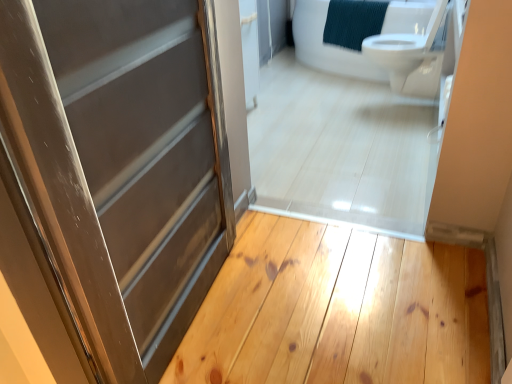
What is the approximate width of matte gray door at center?

The width of matte gray door at center is 3.76 inches.

Find the location of a particular element. The height and width of the screenshot is (384, 512). white glossy toilet at upper right is located at coordinates (412, 55).

Where is `light brown wood plank at center`? light brown wood plank at center is located at coordinates (338, 310).

Is matte gray door at center directly adjacent to light brown wood plank at center?

They are not placed beside each other.

Which object is closer to the camera, matte gray door at center or light brown wood plank at center?

matte gray door at center is closer to the camera.

Which of these two, matte gray door at center or light brown wood plank at center, is smaller?

With smaller size is light brown wood plank at center.

Considering the positions of objects matte gray door at center and light brown wood plank at center in the image provided, who is more to the left, matte gray door at center or light brown wood plank at center?

Positioned to the left is matte gray door at center.

Which of these two, matte gray door at center or white glossy toilet at upper right, is bigger?

With larger size is white glossy toilet at upper right.

Is matte gray door at center to the left of white glossy toilet at upper right from the viewer's perspective?

Correct, you'll find matte gray door at center to the left of white glossy toilet at upper right.

Is matte gray door at center wider than white glossy toilet at upper right?

No, matte gray door at center is not wider than white glossy toilet at upper right.

Considering the points (130, 52) and (421, 74), which point is in front, point (130, 52) or point (421, 74)?

Positioned in front is point (130, 52).

From the image's perspective, would you say white glossy toilet at upper right is positioned over matte gray door at center?

Correct, white glossy toilet at upper right appears higher than matte gray door at center in the image.

Considering the positions of objects white glossy toilet at upper right and matte gray door at center in the image provided, who is more to the right, white glossy toilet at upper right or matte gray door at center?

white glossy toilet at upper right is more to the right.

From a real-world perspective, is white glossy toilet at upper right above or below matte gray door at center?

white glossy toilet at upper right is below matte gray door at center.

Is white glossy toilet at upper right looking in the opposite direction of matte gray door at center?

white glossy toilet at upper right does not have its back to matte gray door at center.

Looking at this image, is light brown wood plank at center spatially inside matte gray door at center, or outside of it?

light brown wood plank at center cannot be found inside matte gray door at center.

Considering the relative sizes of light brown wood plank at center and matte gray door at center in the image provided, is light brown wood plank at center wider than matte gray door at center?

Yes, light brown wood plank at center is wider than matte gray door at center.

Considering the relative positions of light brown wood plank at center and matte gray door at center in the image provided, is light brown wood plank at center to the left or to the right of matte gray door at center?

In the image, light brown wood plank at center appears on the right side of matte gray door at center.

Is light brown wood plank at center next to matte gray door at center?

No, light brown wood plank at center is not beside matte gray door at center.

Relative to light brown wood plank at center, is white glossy toilet at upper right in front or behind?

white glossy toilet at upper right is behind light brown wood plank at center.

Is white glossy toilet at upper right not close to light brown wood plank at center?

Yes, white glossy toilet at upper right and light brown wood plank at center are located far from each other.

Would you say light brown wood plank at center is part of white glossy toilet at upper right's contents?

Definitely not — light brown wood plank at center is not inside white glossy toilet at upper right.

Is light brown wood plank at center at the right side of white glossy toilet at upper right?

No.

Is light brown wood plank at center positioned far away from white glossy toilet at upper right?

Indeed, light brown wood plank at center is not near white glossy toilet at upper right.

Based on the photo, does light brown wood plank at center have a lesser width compared to white glossy toilet at upper right?

Incorrect, the width of light brown wood plank at center is not less than that of white glossy toilet at upper right.

Considering the sizes of objects light brown wood plank at center and white glossy toilet at upper right in the image provided, who is shorter, light brown wood plank at center or white glossy toilet at upper right?

Standing shorter between the two is light brown wood plank at center.

The height and width of the screenshot is (384, 512). I want to click on plank behind the matte gray door at center, so click(x=338, y=310).

Identify the location of toilet directly beneath the matte gray door at center (from a real-world perspective). (412, 55).

From the image, which object appears to be farther from light brown wood plank at center, white glossy toilet at upper right or matte gray door at center?

Based on the image, white glossy toilet at upper right appears to be further to light brown wood plank at center.

Considering their positions, is white glossy toilet at upper right positioned further to matte gray door at center than light brown wood plank at center?

The object further to matte gray door at center is white glossy toilet at upper right.

Based on their spatial positions, is light brown wood plank at center or matte gray door at center further from white glossy toilet at upper right?

matte gray door at center.

Which object lies further to the anchor point matte gray door at center, light brown wood plank at center or white glossy toilet at upper right?

The object further to matte gray door at center is white glossy toilet at upper right.

In the scene shown: Which object lies further to the anchor point light brown wood plank at center, matte gray door at center or white glossy toilet at upper right?

Based on the image, white glossy toilet at upper right appears to be further to light brown wood plank at center.

Estimate the real-world distances between objects in this image. Which object is closer to white glossy toilet at upper right, matte gray door at center or light brown wood plank at center?

light brown wood plank at center.

Identify the location of plank located between matte gray door at center and white glossy toilet at upper right in the depth direction. click(338, 310).